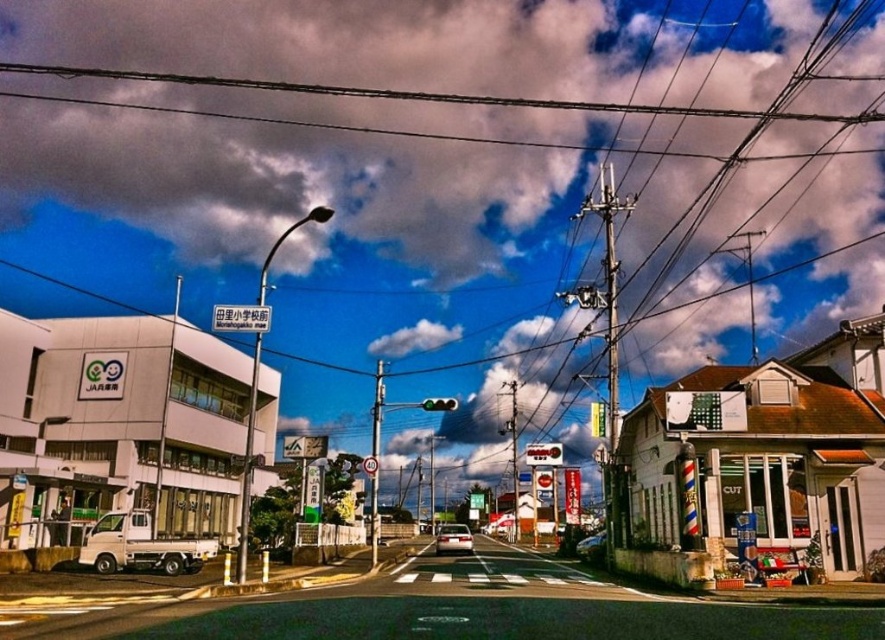
Who is more forward, (251, 86) or (596, 532)?

Point (596, 532) is in front.

Which is behind, point (268, 88) or point (593, 547)?

Point (268, 88)

Where is `metallic wire at upper center`? metallic wire at upper center is located at coordinates (429, 93).

What do you see at coordinates (453, 540) in the screenshot? The height and width of the screenshot is (640, 885). I see `silver metallic car at center` at bounding box center [453, 540].

You are a GUI agent. You are given a task and a screenshot of the screen. Output one action in this format:
    pyautogui.click(x=<x>, y=<y>)
    Task: Click on the silver metallic car at center
    
    Given the screenshot: What is the action you would take?
    pyautogui.click(x=453, y=540)

Locate an element on the screen. blue metallic car at center is located at coordinates (590, 544).

Is blue metallic car at center to the left of green glass traffic light at center from the viewer's perspective?

No, blue metallic car at center is not to the left of green glass traffic light at center.

At what (x,y) coordinates should I click in order to perform the action: click on blue metallic car at center. Please return your answer as a coordinate pair (x, y). Image resolution: width=885 pixels, height=640 pixels. Looking at the image, I should click on (590, 544).

This screenshot has height=640, width=885. I want to click on blue metallic car at center, so click(x=590, y=544).